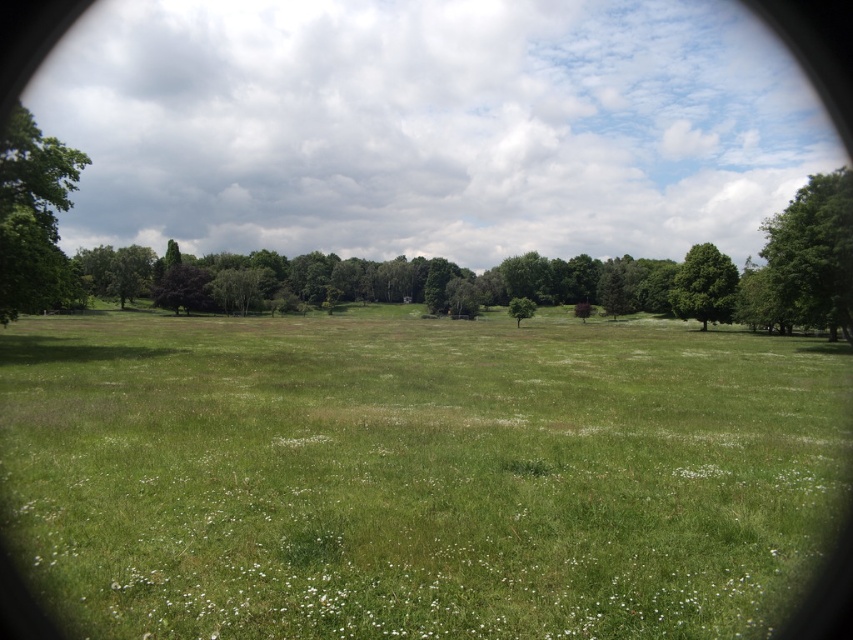
You are standing in the middle of the green grassy field at center and looking towards the green leafy tree at center. Which direction should you walk to reach the tree?

Since the green grassy field at center is below the green leafy tree at center, you should walk upwards towards the tree to reach it.

You are standing in the middle of the field and want to walk towards the trees. Which tree, the green leafy tree at left or the green leafy tree at right, would you find wider when you reach them?

The green leafy tree at right is wider than the green leafy tree at left.